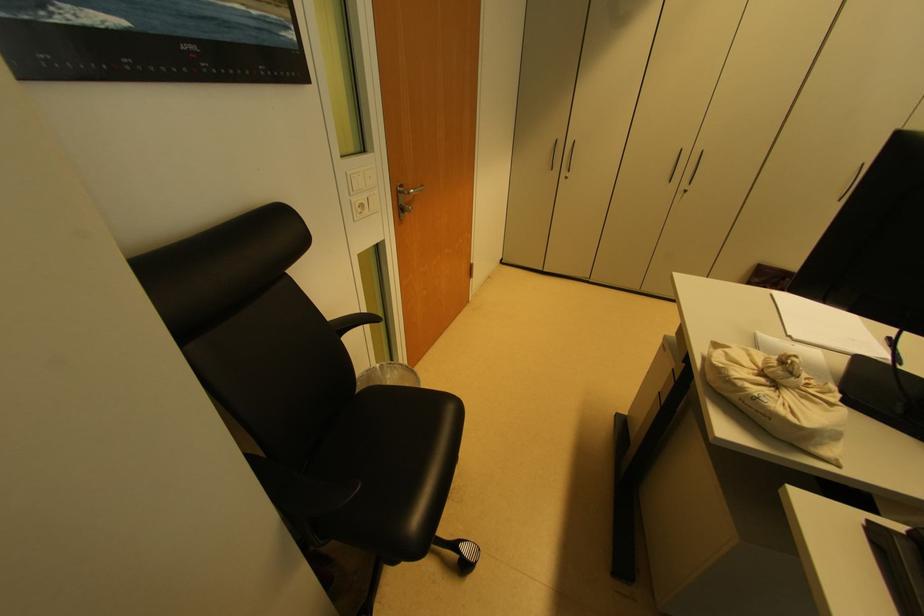
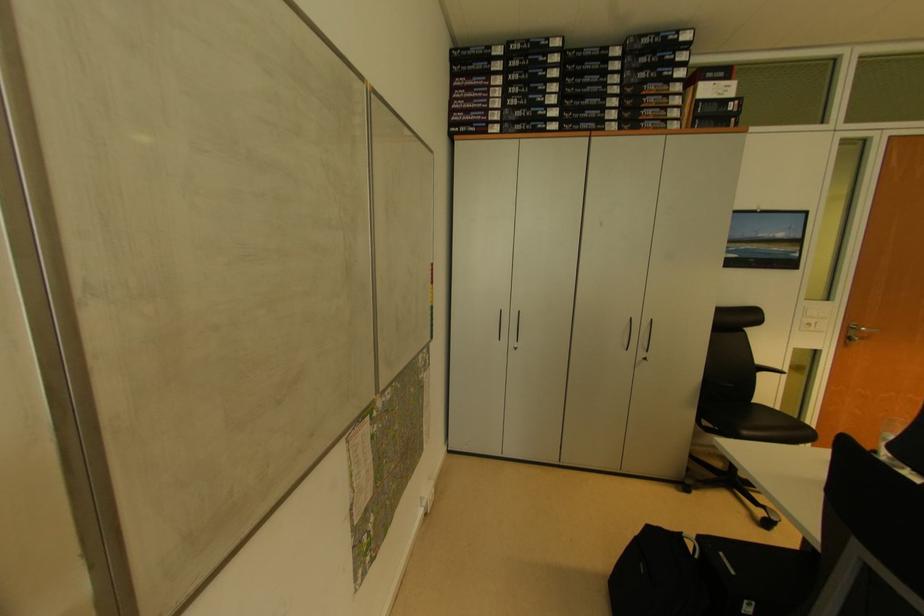
The point at [403,196] is marked in the first image. Where is the corresponding point in the second image?

(855, 331)